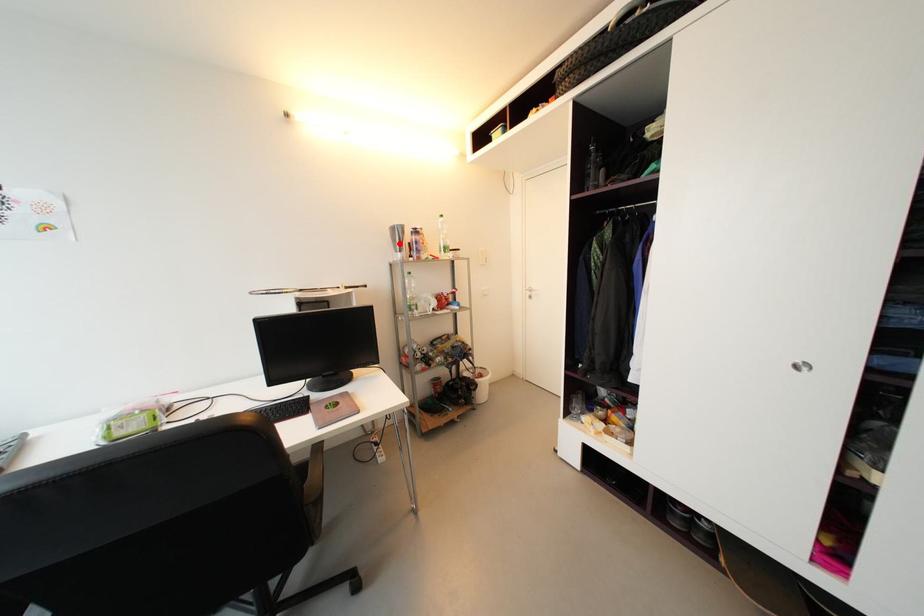
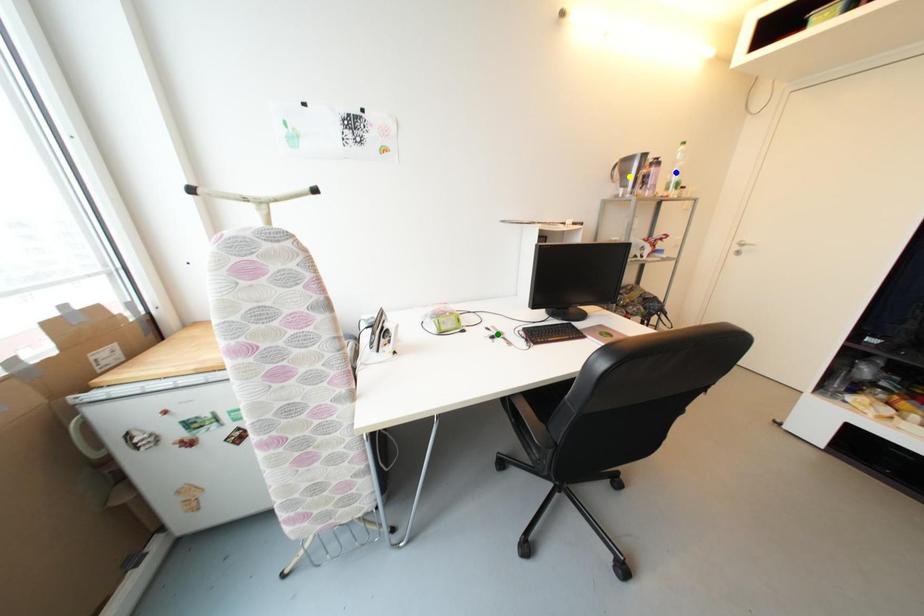
Question: I am providing you with two images of the same scene from different viewpoints. A red point is marked on the first image. You are given multiple points on the second image. Can you choose the point in image 2 that corresponds to the point in image 1?

Choices:
 (A) yellow point
 (B) green point
 (C) blue point

Answer: (A)